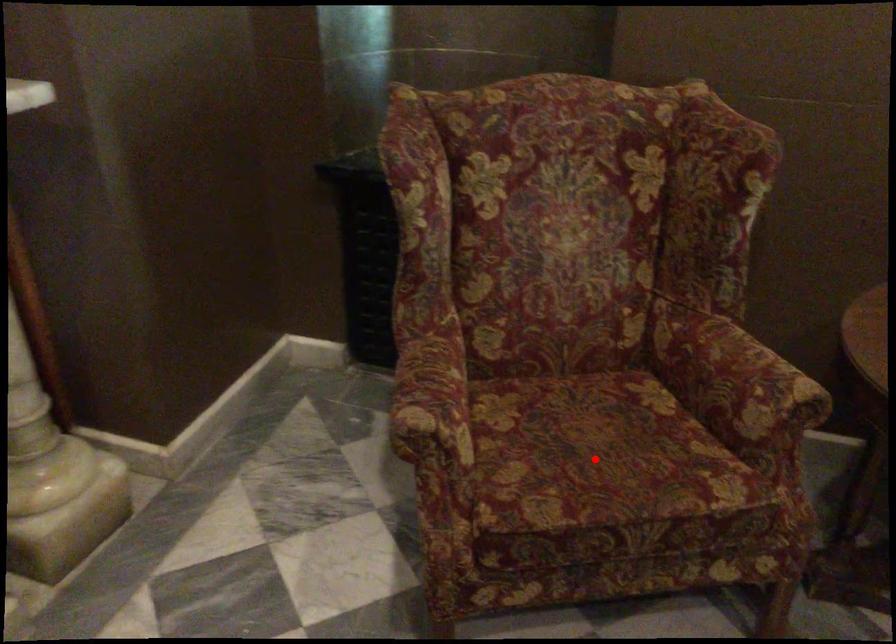
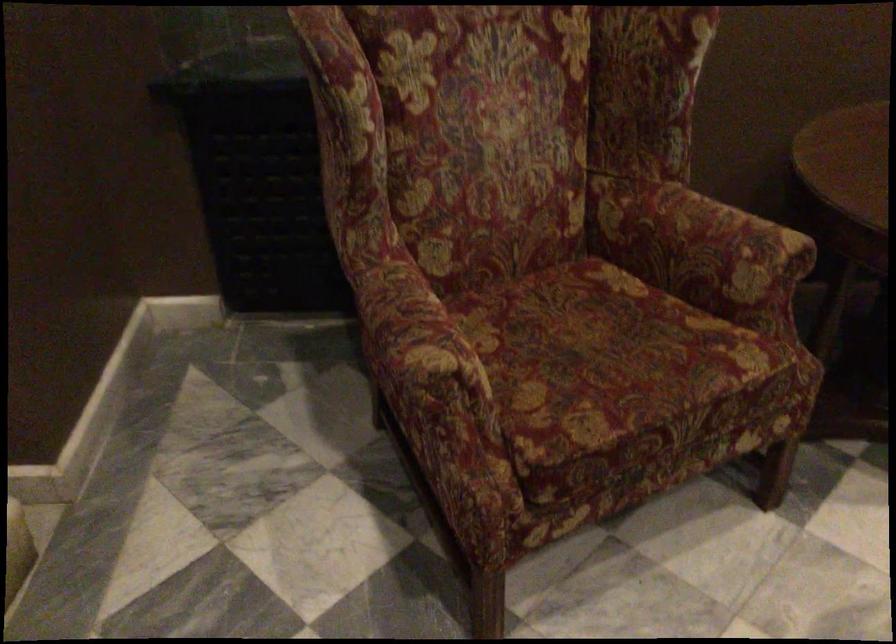
In the second image, find the point that corresponds to the highlighted location in the first image.

(606, 361)